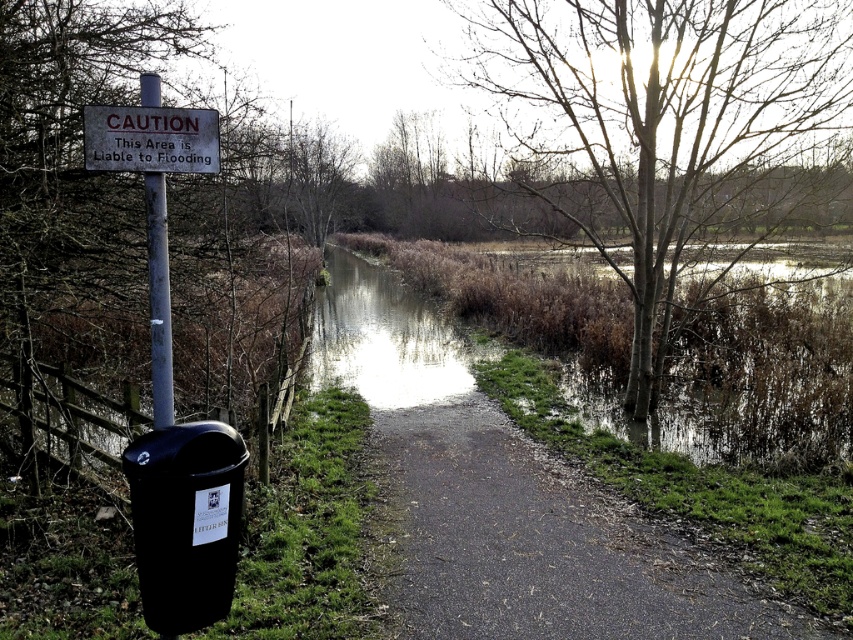
You are a hiker trying to cross the flooded path. You see the bare branches at center and the white plastic pole at upper left. Which object is closer to your current position if you are standing on the path?

The bare branches at center are closer to your current position because they are to the left of the white plastic pole at upper left, which is further away on the upper left side of the path.

In the scene shown: You are a hiker trying to cross the flooded path in the image. You see a bare wood tree at upper center and a white plastic sign at upper left. Which object is taller?

The bare wood tree at upper center is taller than the white plastic sign at upper left.

You are a hiker trying to cross the flooded area. You see the black asphalt path at center and the bare branches at center. Which object is closer to the water surface?

The black asphalt path at center is positioned under bare branches at center, so the black asphalt path at center is closer to the water surface.